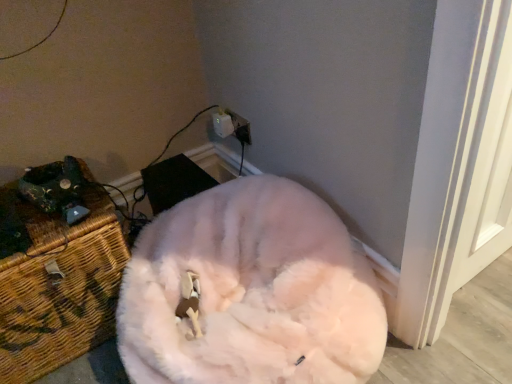
The height and width of the screenshot is (384, 512). I want to click on white fluffy cat at center, so click(x=250, y=292).

Describe the element at coordinates (231, 126) in the screenshot. I see `white plastic electric outlet at upper center` at that location.

This screenshot has height=384, width=512. Find the location of `woven wicker chest at left`. woven wicker chest at left is located at coordinates (59, 287).

Where is `furniture below the white plastic electric outlet at upper center (from the image's perspective)`? furniture below the white plastic electric outlet at upper center (from the image's perspective) is located at coordinates (59, 287).

From the image's perspective, which is above, woven wicker chest at left or white plastic electric outlet at upper center?

white plastic electric outlet at upper center is shown above in the image.

Which is more to the right, woven wicker chest at left or white plastic electric outlet at upper center?

From the viewer's perspective, white plastic electric outlet at upper center appears more on the right side.

Is white plastic electric outlet at upper center at the back of woven wicker chest at left?

No.

From a real-world perspective, is white plastic electric outlet at upper center under woven wicker chest at left?

Incorrect, from a real-world perspective, white plastic electric outlet at upper center is higher than woven wicker chest at left.

Measure the distance from white plastic electric outlet at upper center to woven wicker chest at left.

They are 68.76 centimeters apart.

Is white plastic electric outlet at upper center placed right next to woven wicker chest at left?

white plastic electric outlet at upper center is not next to woven wicker chest at left, and they're not touching.

Locate an element on the screen. furniture that is on the left side of white plastic electric outlet at upper center is located at coordinates (59, 287).

Considering the sizes of objects white fluffy cat at center and white plastic electric outlet at upper center in the image provided, who is bigger, white fluffy cat at center or white plastic electric outlet at upper center?

Bigger between the two is white fluffy cat at center.

Which object is positioned more to the left, white fluffy cat at center or white plastic electric outlet at upper center?

white plastic electric outlet at upper center is more to the left.

Is white fluffy cat at center situated inside white plastic electric outlet at upper center or outside?

white fluffy cat at center lies outside white plastic electric outlet at upper center.

Is white fluffy cat at center located within woven wicker chest at left?

No, white fluffy cat at center is not surrounded by woven wicker chest at left.

Does woven wicker chest at left appear on the right side of white fluffy cat at center?

In fact, woven wicker chest at left is to the left of white fluffy cat at center.

Is woven wicker chest at left bigger or smaller than white fluffy cat at center?

Considering their sizes, woven wicker chest at left takes up less space than white fluffy cat at center.

Considering the positions of points (97, 270) and (214, 308), is point (97, 270) closer to camera compared to point (214, 308)?

No.

Considering the sizes of objects white plastic electric outlet at upper center and white fluffy cat at center in the image provided, who is bigger, white plastic electric outlet at upper center or white fluffy cat at center?

With larger size is white fluffy cat at center.

Is white plastic electric outlet at upper center thinner than white fluffy cat at center?

Correct, the width of white plastic electric outlet at upper center is less than that of white fluffy cat at center.

From the image's perspective, between white plastic electric outlet at upper center and white fluffy cat at center, which one is located above?

white plastic electric outlet at upper center, from the image's perspective.

Is white plastic electric outlet at upper center oriented away from white fluffy cat at center?

No, white fluffy cat at center is not at the back of white plastic electric outlet at upper center.

Which point is more forward, (190, 353) or (33, 329)?

The point (190, 353) is in front.

Is white fluffy cat at center thinner than woven wicker chest at left?

Incorrect, the width of white fluffy cat at center is not less than that of woven wicker chest at left.

Looking at the image, does white fluffy cat at center seem bigger or smaller compared to woven wicker chest at left?

In the image, white fluffy cat at center appears to be larger than woven wicker chest at left.

Identify the location of furniture above the white fluffy cat at center (from a real-world perspective). click(x=59, y=287).

Where is `electric outlet above the woven wicker chest at left (from a real-world perspective)`? The height and width of the screenshot is (384, 512). electric outlet above the woven wicker chest at left (from a real-world perspective) is located at coordinates (231, 126).

This screenshot has height=384, width=512. Find the location of `furniture that appears in front of the white plastic electric outlet at upper center`. furniture that appears in front of the white plastic electric outlet at upper center is located at coordinates (59, 287).

Which object lies nearer to the anchor point woven wicker chest at left, white plastic electric outlet at upper center or white fluffy cat at center?

Based on the image, white fluffy cat at center appears to be nearer to woven wicker chest at left.

Estimate the real-world distances between objects in this image. Which object is further from white plastic electric outlet at upper center, white fluffy cat at center or woven wicker chest at left?

Based on the image, woven wicker chest at left appears to be further to white plastic electric outlet at upper center.

From the image, which object appears to be farther from white fluffy cat at center, white plastic electric outlet at upper center or woven wicker chest at left?

The object further to white fluffy cat at center is white plastic electric outlet at upper center.

When comparing their distances from woven wicker chest at left, does white fluffy cat at center or white plastic electric outlet at upper center seem closer?

Among the two, white fluffy cat at center is located nearer to woven wicker chest at left.

Which object lies further to the anchor point white fluffy cat at center, woven wicker chest at left or white plastic electric outlet at upper center?

white plastic electric outlet at upper center lies further to white fluffy cat at center than the other object.

Looking at the image, which one is located closer to white plastic electric outlet at upper center, woven wicker chest at left or white fluffy cat at center?

Among the two, white fluffy cat at center is located nearer to white plastic electric outlet at upper center.

Where is `furniture positioned between white fluffy cat at center and white plastic electric outlet at upper center from near to far`? The height and width of the screenshot is (384, 512). furniture positioned between white fluffy cat at center and white plastic electric outlet at upper center from near to far is located at coordinates (59, 287).